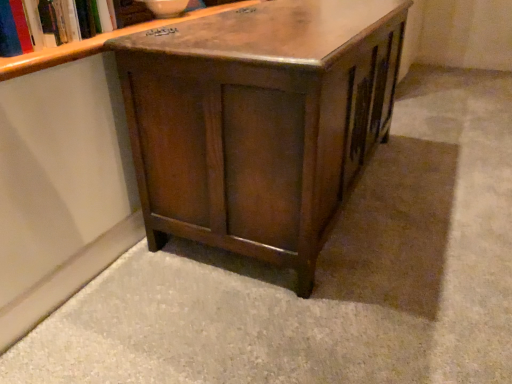
Question: From the image's perspective, is wooden bookshelf at upper left on wooden cabinet at center?

Choices:
 (A) no
 (B) yes

Answer: (B)

Question: Does wooden bookshelf at upper left have a lesser height compared to wooden cabinet at center?

Choices:
 (A) yes
 (B) no

Answer: (A)

Question: From a real-world perspective, is wooden bookshelf at upper left over wooden cabinet at center?

Choices:
 (A) yes
 (B) no

Answer: (A)

Question: Is wooden bookshelf at upper left aimed at wooden cabinet at center?

Choices:
 (A) no
 (B) yes

Answer: (A)

Question: From the image's perspective, is wooden bookshelf at upper left below wooden cabinet at center?

Choices:
 (A) no
 (B) yes

Answer: (A)

Question: Is wooden bookshelf at upper left to the right of wooden cabinet at center from the viewer's perspective?

Choices:
 (A) yes
 (B) no

Answer: (B)

Question: From the image's perspective, is wooden cabinet at center under wooden bookshelf at upper left?

Choices:
 (A) no
 (B) yes

Answer: (B)

Question: Does wooden cabinet at center have a lesser width compared to wooden bookshelf at upper left?

Choices:
 (A) yes
 (B) no

Answer: (B)

Question: Is wooden cabinet at center positioned with its back to wooden bookshelf at upper left?

Choices:
 (A) yes
 (B) no

Answer: (B)

Question: From a real-world perspective, is wooden cabinet at center physically below wooden bookshelf at upper left?

Choices:
 (A) no
 (B) yes

Answer: (B)

Question: Is wooden cabinet at center shorter than wooden bookshelf at upper left?

Choices:
 (A) yes
 (B) no

Answer: (B)

Question: Does wooden cabinet at center come in front of wooden bookshelf at upper left?

Choices:
 (A) no
 (B) yes

Answer: (B)

Question: From the image's perspective, relative to wooden cabinet at center, is wooden bookshelf at upper left above or below?

Choices:
 (A) above
 (B) below

Answer: (A)